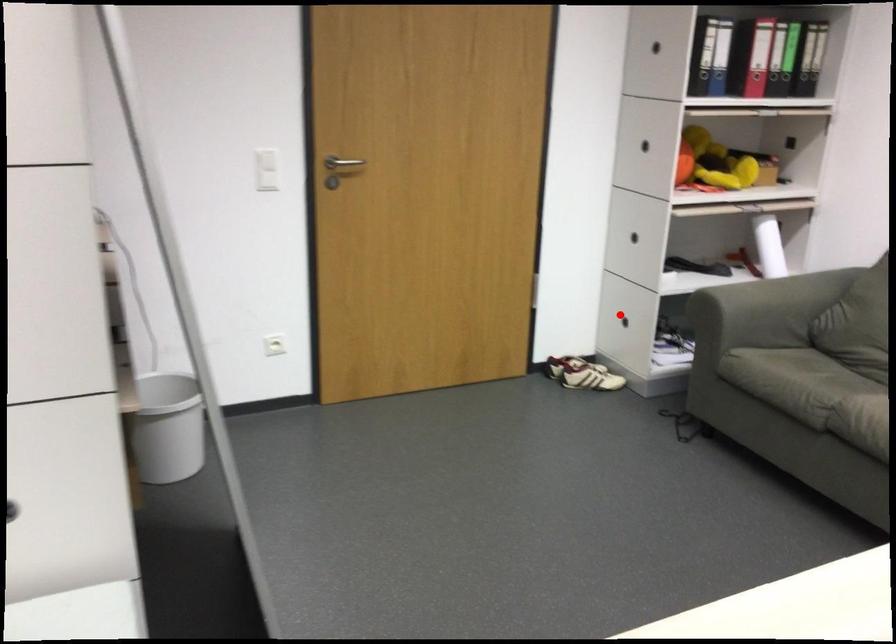
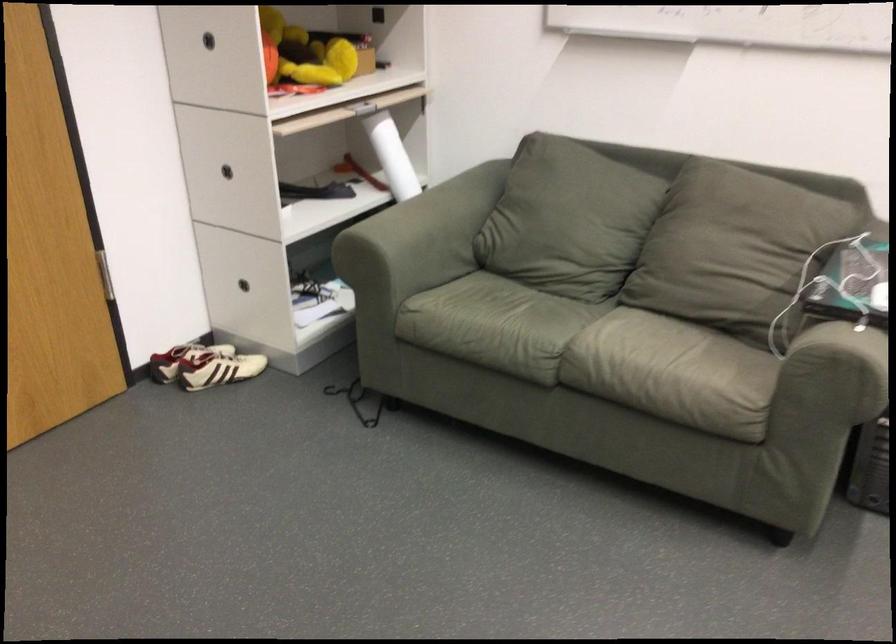
Find the pixel in the second image that matches the highlighted location in the first image.

(252, 283)